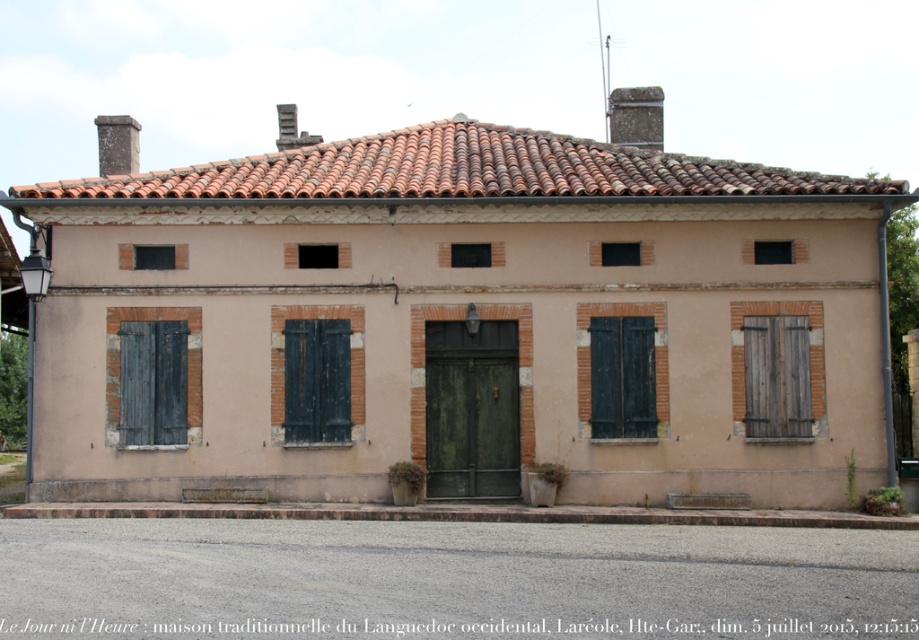
You are an architect assessing the facade of this traditional building. You need to determine the relative sizes of the black wood shutter at center and the wooden at right. Which one is taller?

The black wood shutter at center is taller than the wooden at right.

You are standing in front of the traditional building and notice two wooden features. One is the wooden at right and the other is the brown wooden shutter at center. Which of these two wooden features is positioned higher up on the building?

The wooden at right is positioned higher up on the building than the brown wooden shutter at center.